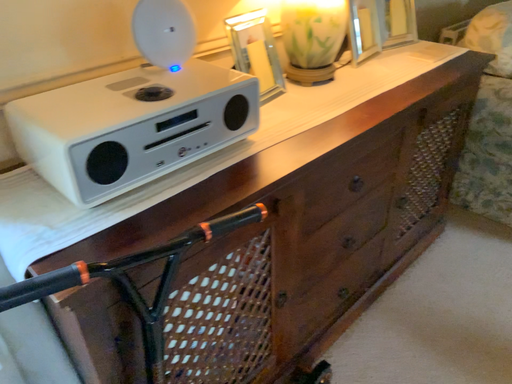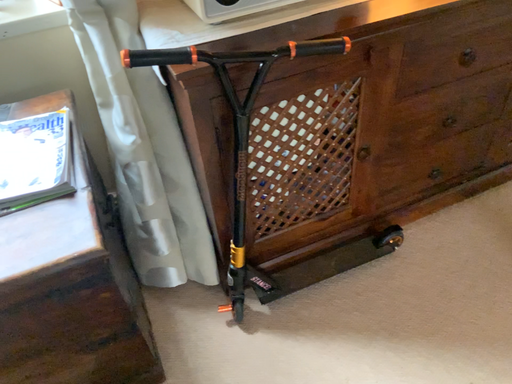
Question: How did the camera likely rotate when shooting the video?

Choices:
 (A) rotated left
 (B) rotated right

Answer: (A)